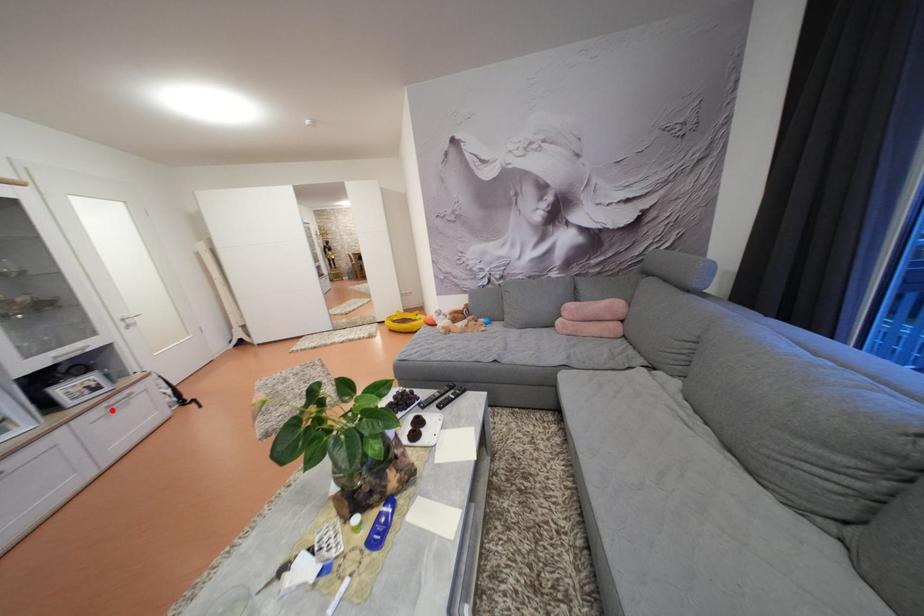
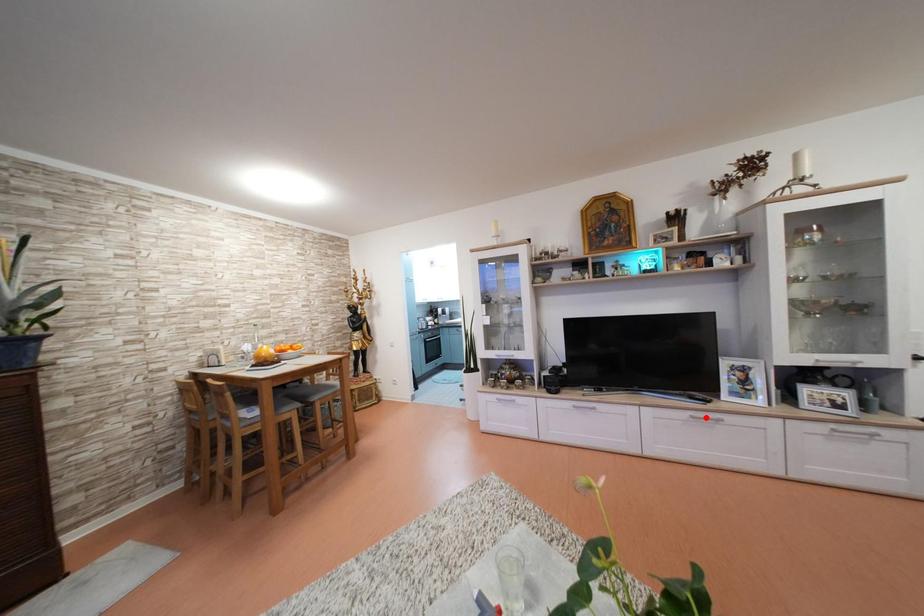
From the picture: I am providing you with two images of the same scene from different viewpoints. A red point is marked on the first image and another point is marked on the second image. Is the marked point in image1 the same physical position as the marked point in image2?

No